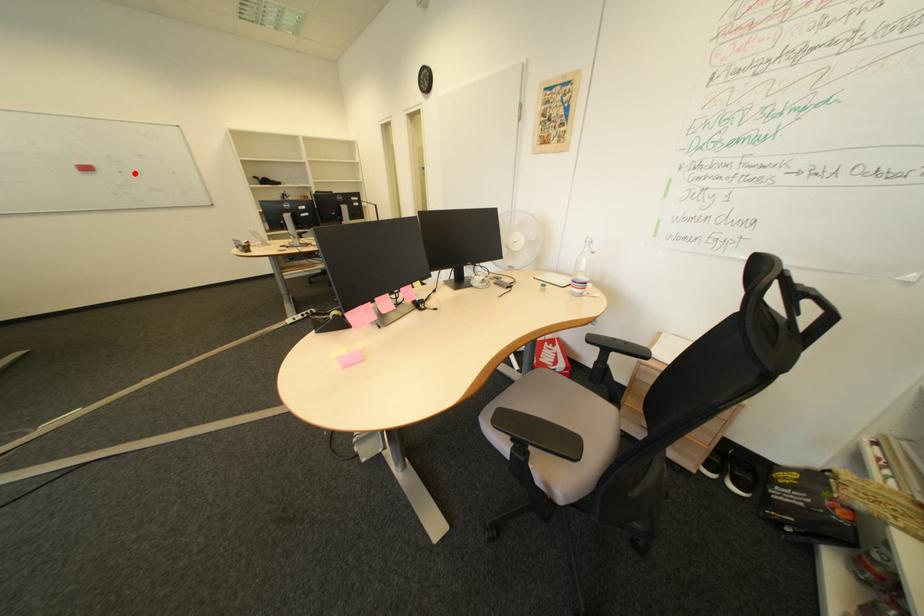
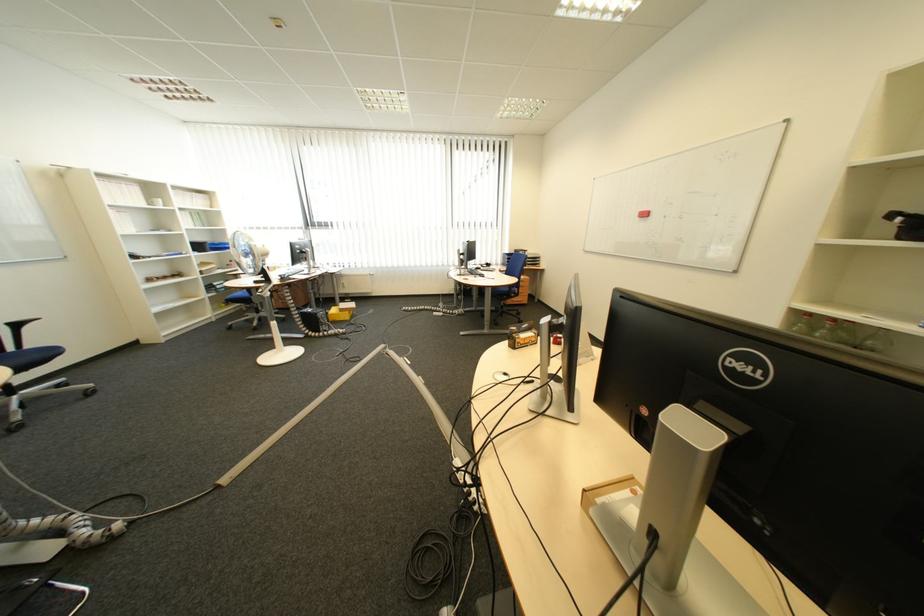
In the second image, find the point that corresponds to the highlighted location in the first image.

(677, 217)